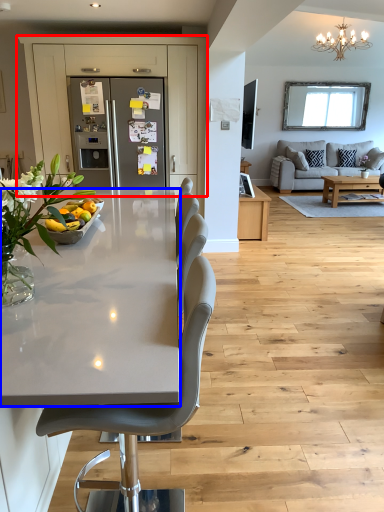
Question: Which object is further to the camera taking this photo, cabinetry (highlighted by a red box) or countertop (highlighted by a blue box)?

Choices:
 (A) cabinetry
 (B) countertop

Answer: (A)